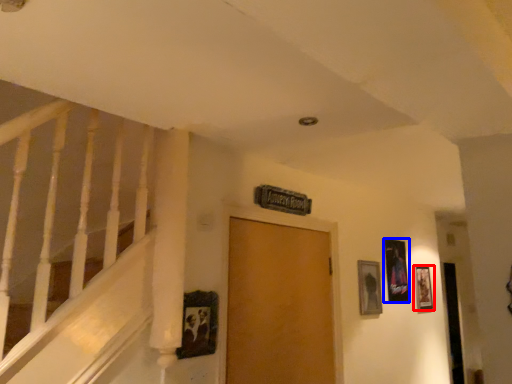
Question: Which of the following is the closest to the observer, picture frame (highlighted by a red box) or picture frame (highlighted by a blue box)?

Choices:
 (A) picture frame
 (B) picture frame

Answer: (B)